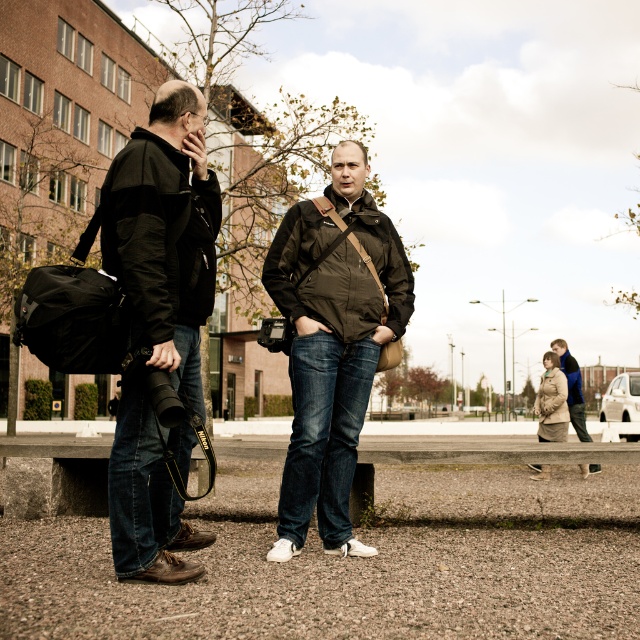
Is matte black jacket at left to the right of brown textured jacket at lower right from the viewer's perspective?

In fact, matte black jacket at left is to the left of brown textured jacket at lower right.

Between point (140, 500) and point (554, 388), which one is positioned behind?

Positioned behind is point (554, 388).

Between point (189, 188) and point (563, 374), which one is positioned behind?

The point (563, 374) is more distant.

Find the location of `matte black jacket at left`. matte black jacket at left is located at coordinates (157, 323).

Is point (204, 128) positioned after point (145, 269)?

Yes.

Between point (204, 150) and point (186, 184), which one is positioned behind?

The point (204, 150) is more distant.

Is point (125, 216) positioned after point (205, 208)?

No.

Locate an element on the screen. matte black jacket at left is located at coordinates (157, 323).

In the scene shown: Is matte black jacket at left thinner than blue fleece jacket at lower right?

Yes, matte black jacket at left is thinner than blue fleece jacket at lower right.

Between matte black jacket at left and blue fleece jacket at lower right, which one is positioned lower?

blue fleece jacket at lower right is lower down.

Is point (106, 220) farther from camera compared to point (566, 394)?

No, it is in front of (566, 394).

What are the coordinates of `matte black jacket at left` in the screenshot? It's located at tap(157, 323).